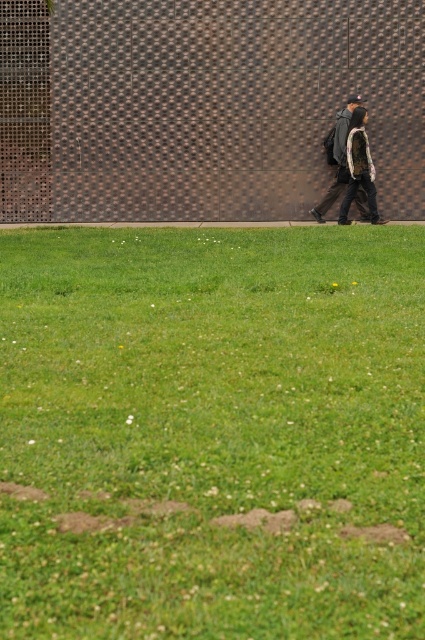
Question: Can you confirm if camouflage jacket at right is positioned above dark gray backpack at center?

Choices:
 (A) no
 (B) yes

Answer: (A)

Question: Which of these objects is positioned closest to the dark gray backpack at center?

Choices:
 (A) green grass at lower center
 (B) camouflage jacket at right

Answer: (B)

Question: Which object is positioned farthest from the dark gray backpack at center?

Choices:
 (A) camouflage jacket at right
 (B) green grass at lower center

Answer: (B)

Question: Can you confirm if green grass at lower center is wider than dark gray backpack at center?

Choices:
 (A) yes
 (B) no

Answer: (A)

Question: Is green grass at lower center wider than camouflage jacket at right?

Choices:
 (A) yes
 (B) no

Answer: (A)

Question: Which of these objects is positioned closest to the green grass at lower center?

Choices:
 (A) dark gray backpack at center
 (B) camouflage jacket at right

Answer: (B)